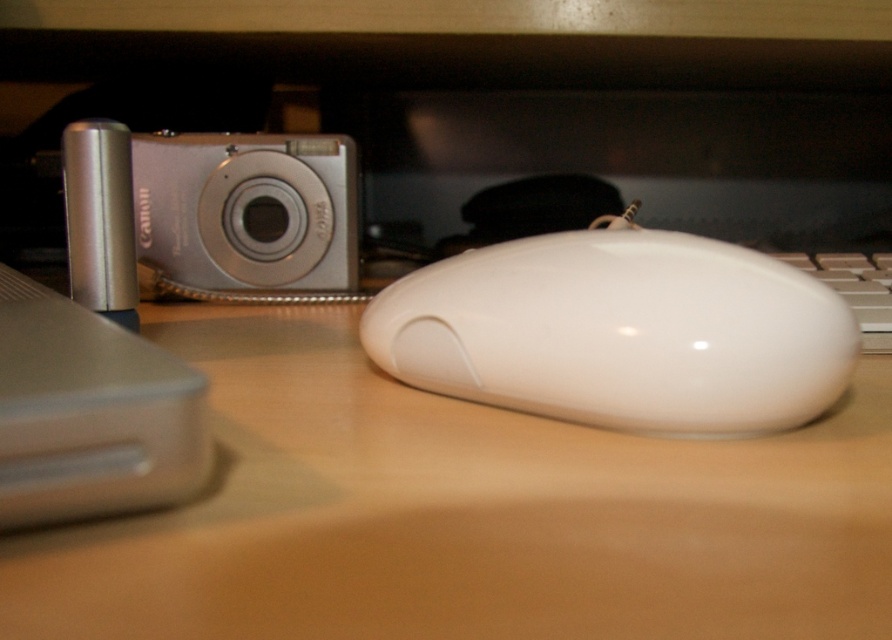
Question: Can you confirm if white glossy mouse at center is positioned to the left of white plastic keyboard at right?

Choices:
 (A) no
 (B) yes

Answer: (B)

Question: Which is nearer to the white glossy mouse at center?

Choices:
 (A) white plastic keyboard at right
 (B) white matte mouse at center

Answer: (B)

Question: Is white matte mouse at center smaller than white glossy mouse at center?

Choices:
 (A) yes
 (B) no

Answer: (B)

Question: Which object appears closest to the camera in this image?

Choices:
 (A) white plastic keyboard at right
 (B) white matte mouse at center
 (C) white glossy mouse at center

Answer: (B)

Question: Is white matte mouse at center bigger than white glossy mouse at center?

Choices:
 (A) yes
 (B) no

Answer: (A)

Question: Which point is closer to the camera?

Choices:
 (A) (716, 269)
 (B) (777, 253)

Answer: (A)